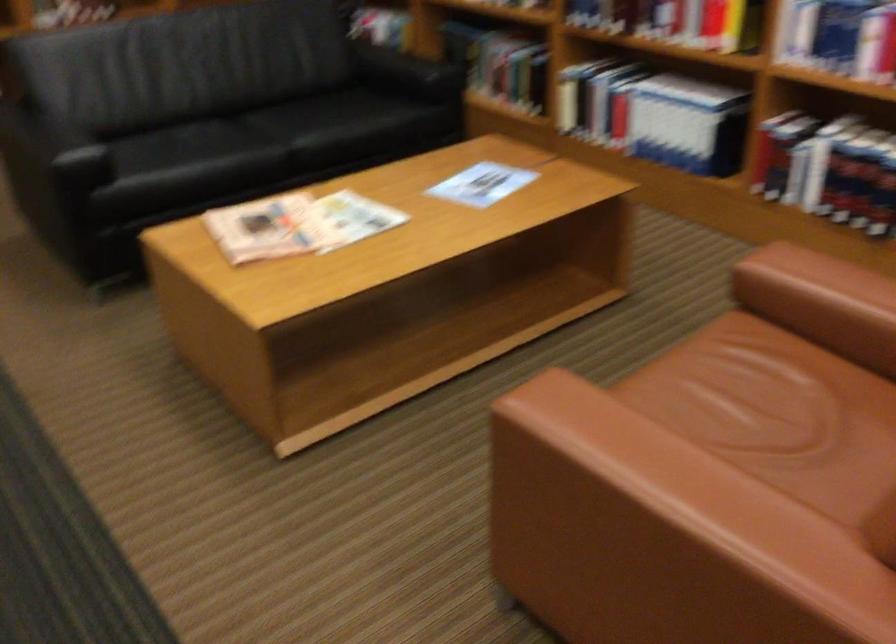
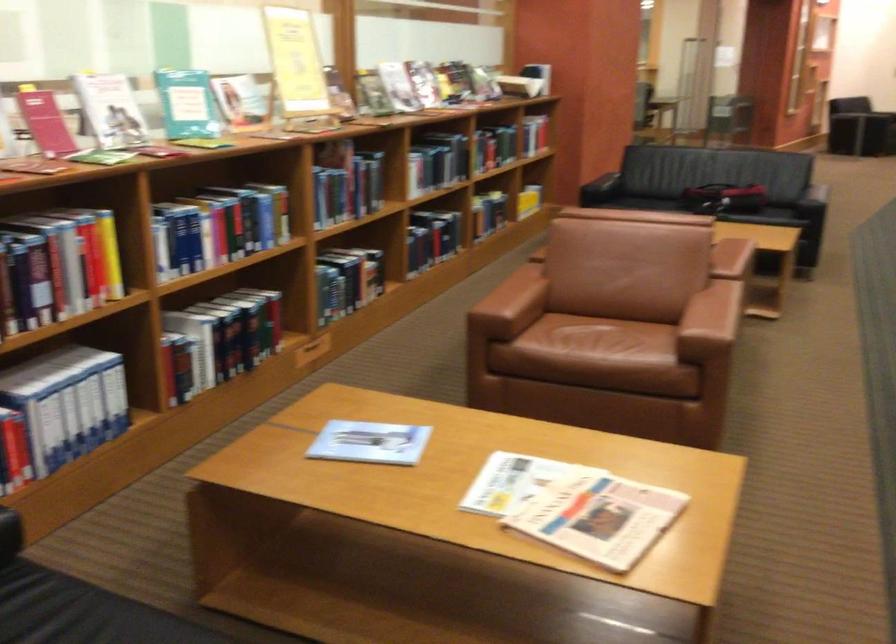
Where in the second image is the point corresponding to point (719, 553) from the first image?

(719, 296)